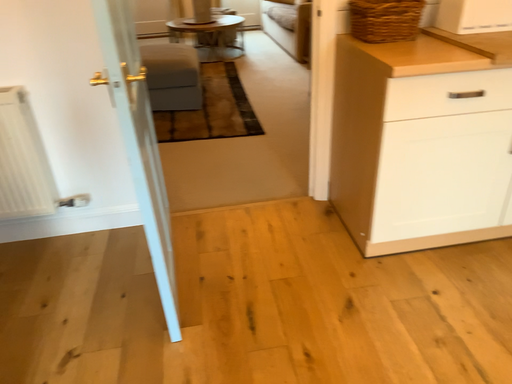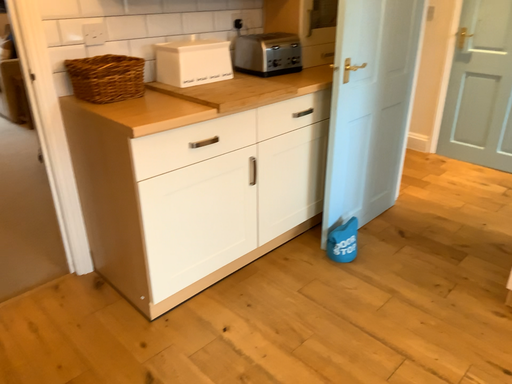
Question: Which way did the camera rotate in the video?

Choices:
 (A) rotated upward
 (B) rotated downward

Answer: (A)